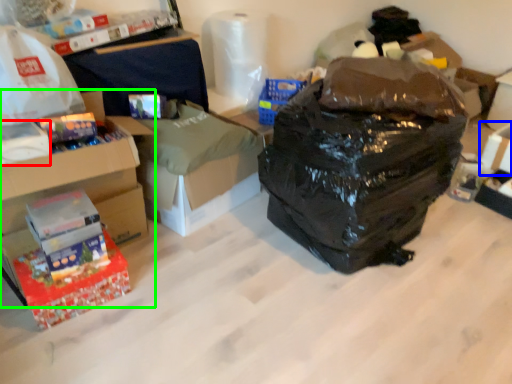
Question: Based on their relative distances, which object is nearer to box (highlighted by a red box)? Choose from storage box (highlighted by a blue box) and box (highlighted by a green box).

Choices:
 (A) storage box
 (B) box

Answer: (B)